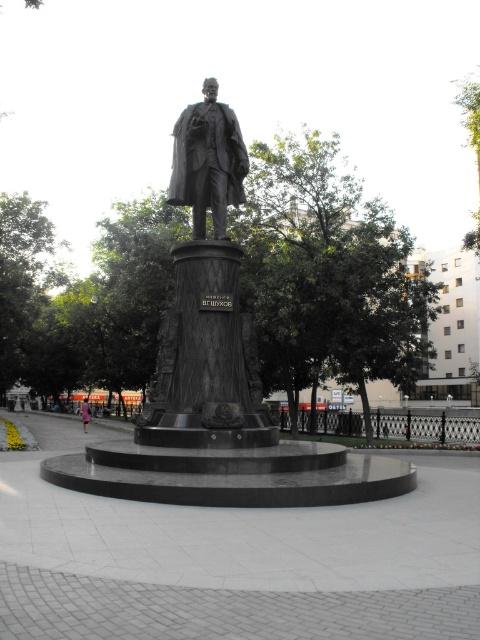
Which is above, polished bronze statue at center or bronze statue at center?

bronze statue at center

From the picture: Between polished bronze statue at center and bronze statue at center, which one is positioned lower?

polished bronze statue at center

Who is more forward, (x=203, y=406) or (x=216, y=227)?

Point (x=203, y=406) is more forward.

The height and width of the screenshot is (640, 480). What are the coordinates of `polished bronze statue at center` in the screenshot? It's located at (206, 298).

Which of these two, bronze statue at center or pink fabric dress at center, stands taller?

Standing taller between the two is bronze statue at center.

Is bronze statue at center further to the viewer compared to pink fabric dress at center?

No.

Identify the location of bronze statue at center. Image resolution: width=480 pixels, height=640 pixels. (207, 161).

Is the position of polished bronze statue at center more distant than that of pink fabric dress at center?

No, polished bronze statue at center is in front of pink fabric dress at center.

Can you confirm if polished bronze statue at center is positioned to the left of pink fabric dress at center?

In fact, polished bronze statue at center is to the right of pink fabric dress at center.

Where is `polished bronze statue at center`? This screenshot has width=480, height=640. polished bronze statue at center is located at coordinates (206, 298).